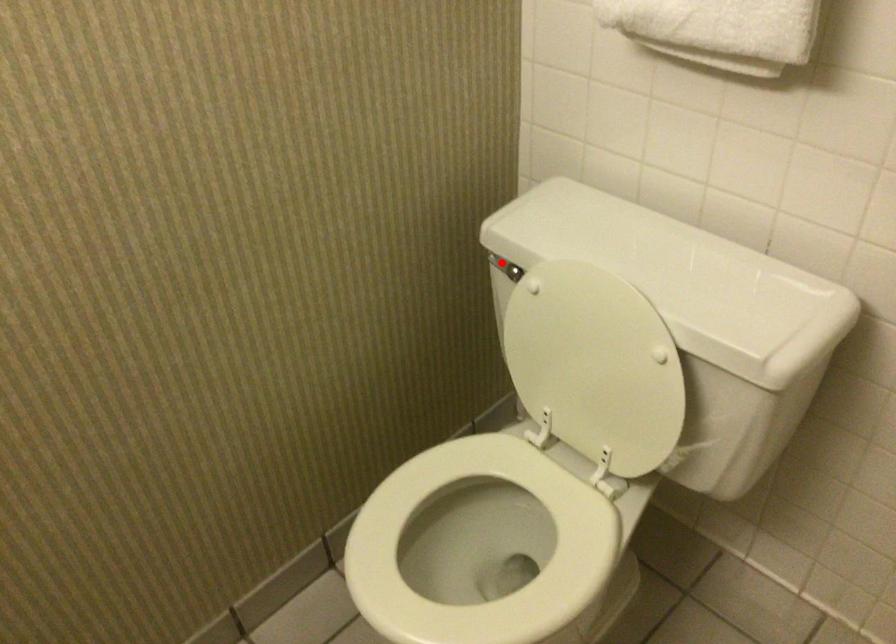
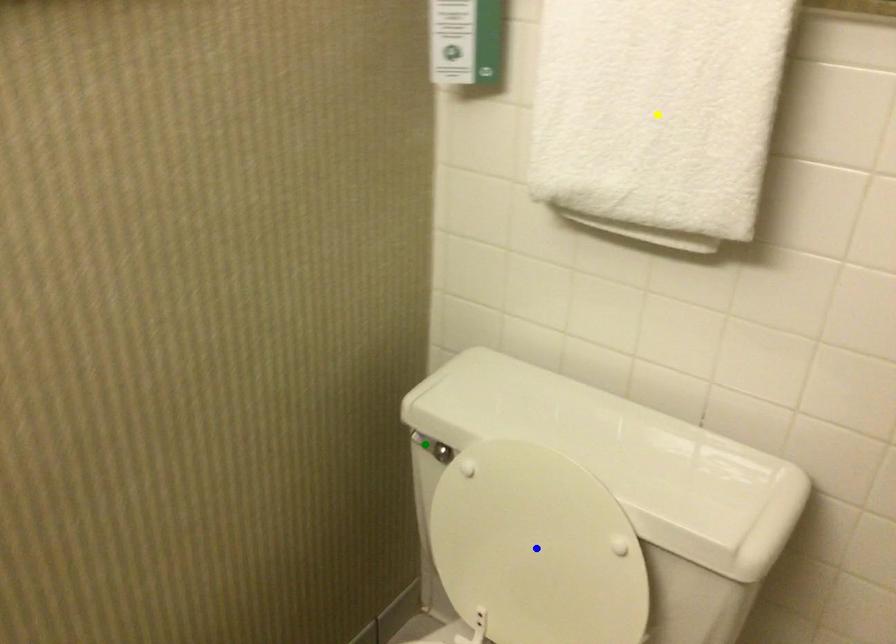
Question: I am providing you with two images of the same scene from different viewpoints. A red point is marked on the first image. You are given multiple points on the second image. In image 2, which mark is for the same physical point as the one in image 1?

Choices:
 (A) green point
 (B) blue point
 (C) yellow point

Answer: (A)